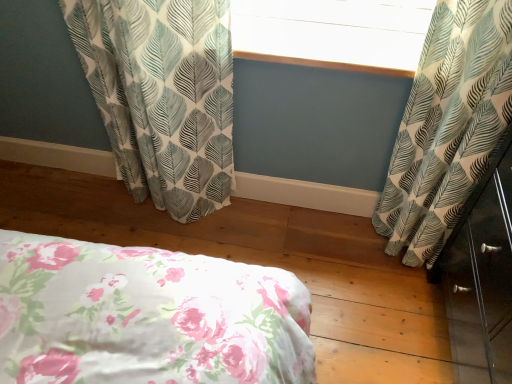
The image size is (512, 384). Find the location of `vacant area situated below white leaf-patterned curtain at left, marked as the first curtain in a left-to-right arrangement (from a real-world perspective)`. vacant area situated below white leaf-patterned curtain at left, marked as the first curtain in a left-to-right arrangement (from a real-world perspective) is located at coordinates (194, 217).